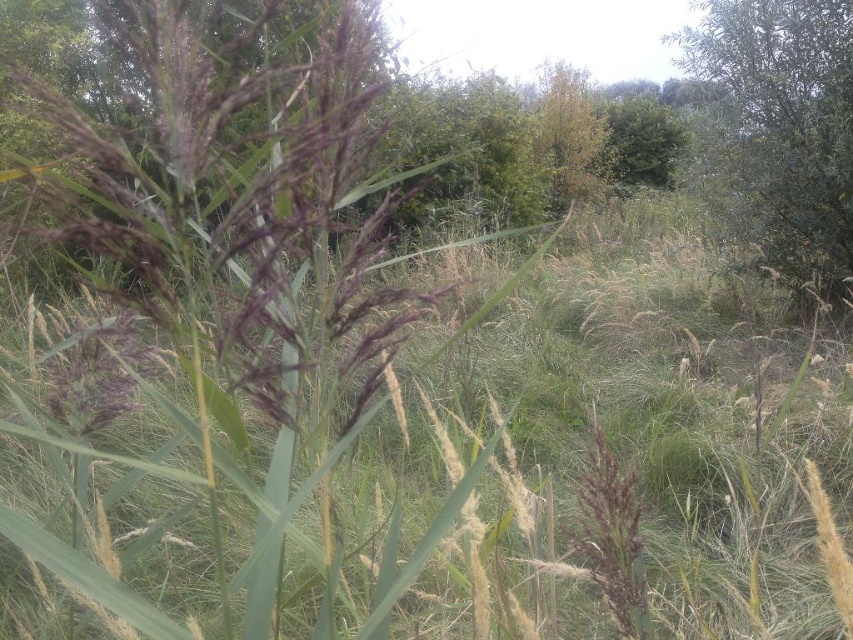
Does purple matte grass at center appear over green leafy tree at upper right?

No, purple matte grass at center is not above green leafy tree at upper right.

Who is more forward, (593, 244) or (843, 227)?

Positioned in front is point (843, 227).

Measure the distance between purple matte grass at center and camera.

purple matte grass at center is 7.64 feet from camera.

Locate an element on the screen. The height and width of the screenshot is (640, 853). purple matte grass at center is located at coordinates (462, 472).